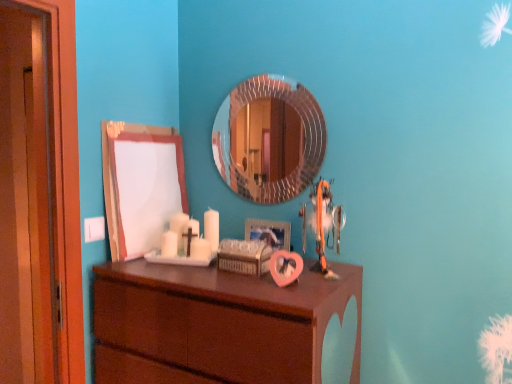
Question: Is orange fabric toy at center located within rounded silver mirror at center, the 1th mirror viewed from the right?

Choices:
 (A) no
 (B) yes

Answer: (A)

Question: Considering the relative positions of rounded silver mirror at center, the second mirror positioned from the left, and orange fabric toy at center in the image provided, is rounded silver mirror at center, the second mirror positioned from the left, to the left of orange fabric toy at center from the viewer's perspective?

Choices:
 (A) no
 (B) yes

Answer: (B)

Question: Is rounded silver mirror at center, the 1th mirror viewed from the right, not close to orange fabric toy at center?

Choices:
 (A) no
 (B) yes

Answer: (A)

Question: Is rounded silver mirror at center, the 1th mirror viewed from the right, smaller than orange fabric toy at center?

Choices:
 (A) yes
 (B) no

Answer: (A)

Question: Is rounded silver mirror at center, the second mirror positioned from the left, positioned beyond the bounds of orange fabric toy at center?

Choices:
 (A) yes
 (B) no

Answer: (A)

Question: Would you say white matte board at upper left, which is the first mirror from left to right, is inside or outside rounded silver mirror at center, the 1th mirror viewed from the right?

Choices:
 (A) inside
 (B) outside

Answer: (B)

Question: In terms of size, does white matte board at upper left, which ranks as the second mirror in right-to-left order, appear bigger or smaller than rounded silver mirror at center, the 1th mirror viewed from the right?

Choices:
 (A) big
 (B) small

Answer: (A)

Question: In terms of height, does white matte board at upper left, which ranks as the second mirror in right-to-left order, look taller or shorter compared to rounded silver mirror at center, the second mirror positioned from the left?

Choices:
 (A) short
 (B) tall

Answer: (B)

Question: Looking at their shapes, would you say white matte board at upper left, which ranks as the second mirror in right-to-left order, is wider or thinner than rounded silver mirror at center, the 1th mirror viewed from the right?

Choices:
 (A) wide
 (B) thin

Answer: (A)

Question: Considering the positions of rounded silver mirror at center, the second mirror positioned from the left, and white matte board at upper left, which ranks as the second mirror in right-to-left order, in the image, is rounded silver mirror at center, the second mirror positioned from the left, wider or thinner than white matte board at upper left, which ranks as the second mirror in right-to-left order,?

Choices:
 (A) thin
 (B) wide

Answer: (A)

Question: Is rounded silver mirror at center, the second mirror positioned from the left, inside or outside of white matte board at upper left, which ranks as the second mirror in right-to-left order?

Choices:
 (A) outside
 (B) inside

Answer: (A)

Question: Considering the positions of rounded silver mirror at center, the 1th mirror viewed from the right, and white matte board at upper left, which is the first mirror from left to right, in the image, is rounded silver mirror at center, the 1th mirror viewed from the right, bigger or smaller than white matte board at upper left, which is the first mirror from left to right,?

Choices:
 (A) small
 (B) big

Answer: (A)

Question: Is rounded silver mirror at center, the second mirror positioned from the left, taller or shorter than white matte board at upper left, which is the first mirror from left to right?

Choices:
 (A) short
 (B) tall

Answer: (A)

Question: Considering the positions of white matte board at upper left, which is the first mirror from left to right, and brown wood chest of drawers at center in the image, is white matte board at upper left, which is the first mirror from left to right, taller or shorter than brown wood chest of drawers at center?

Choices:
 (A) short
 (B) tall

Answer: (A)

Question: Does point (106, 218) appear closer or farther from the camera than point (340, 288)?

Choices:
 (A) closer
 (B) farther

Answer: (B)